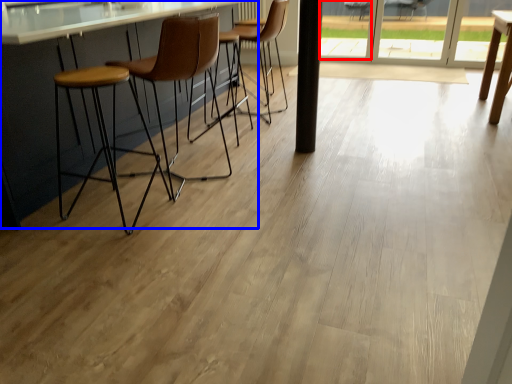
Question: Among these objects, which one is nearest to the camera, window (highlighted by a red box) or counter (highlighted by a blue box)?

Choices:
 (A) window
 (B) counter

Answer: (B)